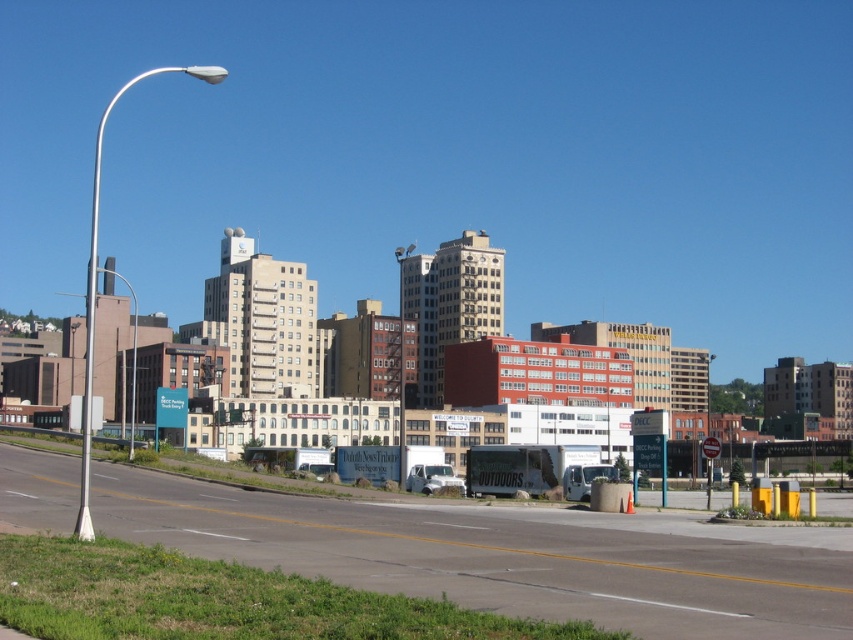
Who is more forward, (90, 451) or (134, 317)?

Point (90, 451)

Is white metallic pole at left thinner than metallic gray pole at left?

No, white metallic pole at left is not thinner than metallic gray pole at left.

Does point (190, 65) come behind point (108, 269)?

Yes, it is.

The height and width of the screenshot is (640, 853). In order to click on white metallic pole at left in this screenshot , I will do `click(96, 282)`.